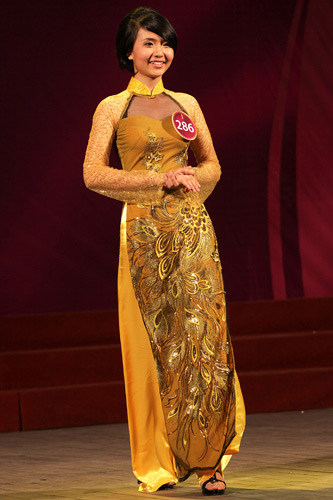
Where is `stair faces`? stair faces is located at coordinates (83, 407), (79, 367), (65, 327).